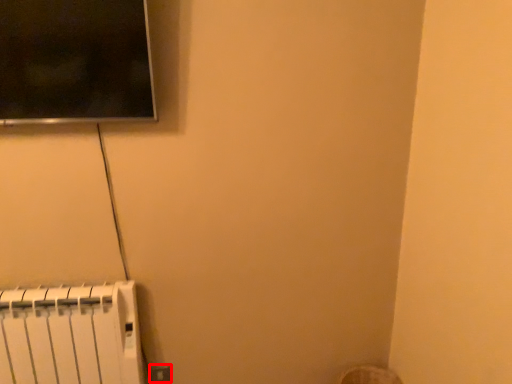
Question: From the image's perspective, what is the correct spatial relationship of electric outlet (annotated by the red box) in relation to radiator?

Choices:
 (A) above
 (B) below

Answer: (B)